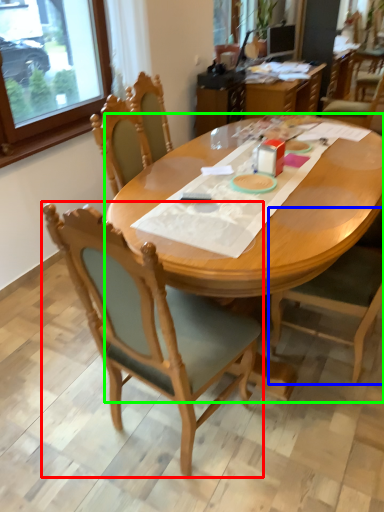
Question: Considering the real-world distances, which object is farthest from chair (highlighted by a red box)? chair (highlighted by a blue box) or desk (highlighted by a green box)?

Choices:
 (A) chair
 (B) desk

Answer: (A)